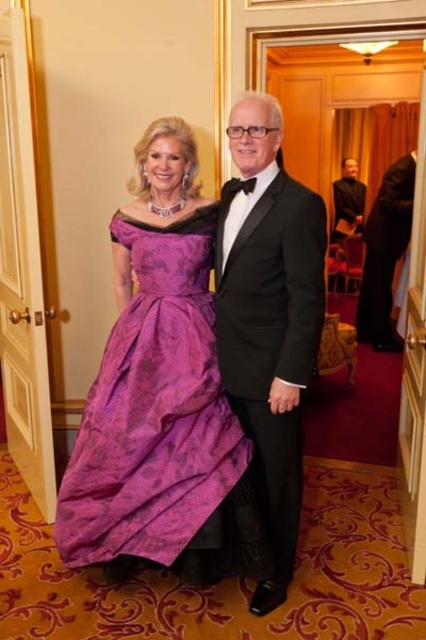
Question: Does black satin suit at right appear on the right side of black satin suit at center?

Choices:
 (A) no
 (B) yes

Answer: (B)

Question: Among these objects, which one is nearest to the camera?

Choices:
 (A) black satin suit at right
 (B) purple silk dress at center
 (C) black satin suit at center
 (D) black satin tuxedo at center

Answer: (D)

Question: Which point is farther to the camera?

Choices:
 (A) (359, 221)
 (B) (227, 232)

Answer: (A)

Question: Can you confirm if black satin tuxedo at center is thinner than black satin suit at center?

Choices:
 (A) yes
 (B) no

Answer: (B)

Question: Is black satin tuxedo at center below black satin suit at right?

Choices:
 (A) no
 (B) yes

Answer: (B)

Question: Which point is closer to the camera taking this photo?

Choices:
 (A) (344, 161)
 (B) (373, 307)

Answer: (B)